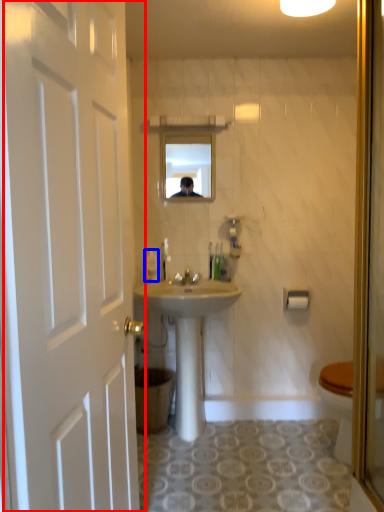
Question: Which object is closer to the camera taking this photo, door (highlighted by a red box) or toiletries (highlighted by a blue box)?

Choices:
 (A) door
 (B) toiletries

Answer: (A)